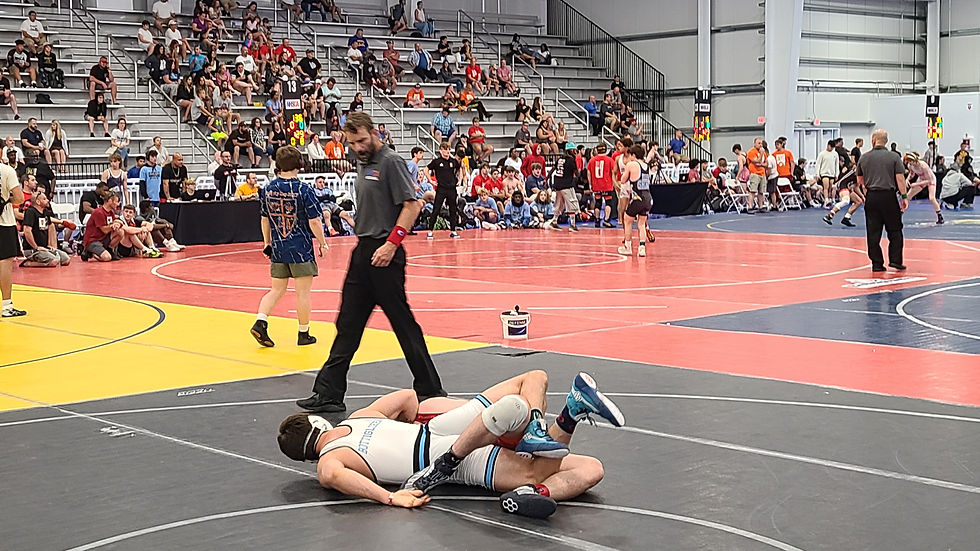
Where is `yellow floor`? This screenshot has height=551, width=980. yellow floor is located at coordinates (383, 347), (233, 351), (43, 383), (172, 313), (51, 301), (144, 396).